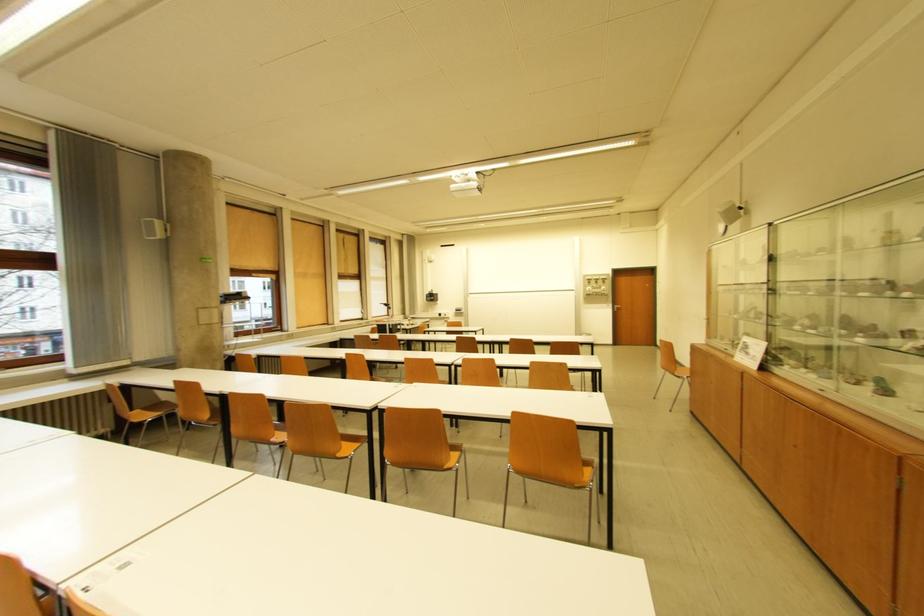
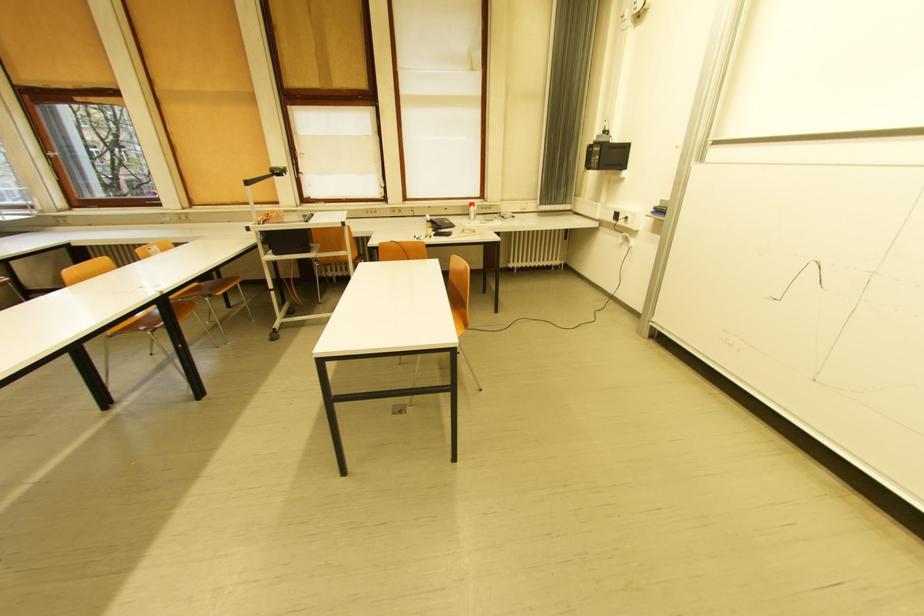
Find the pixel in the second image that matches the point at 433,302 in the first image.

(592, 168)